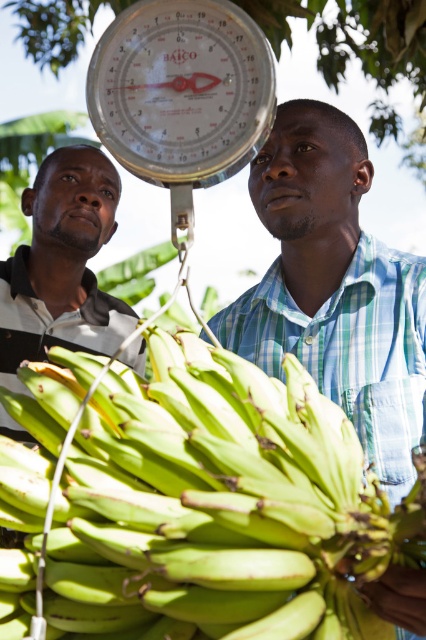
You are a customer trying to buy bananas from the vendor. You see the white metallic scale at center and the striped cotton shirt at left. Which object is closer to the right side of the image?

The white metallic scale at center is closer to the right side of the image because it is positioned to the right of the striped cotton shirt at left.

Consider the image. You are trying to determine if the green matte bananas at center can fit into a box that is the same size as the white metallic scale at center. Based on their sizes, will the bananas fit?

The green matte bananas at center are wider than the white metallic scale at center, so they will not fit into a box the same size as the scale.

You are a customer at a local market and see the green matte bananas at center and the white metallic scale at center. Which object is shorter?

The green matte bananas at center are shorter than the white metallic scale at center.